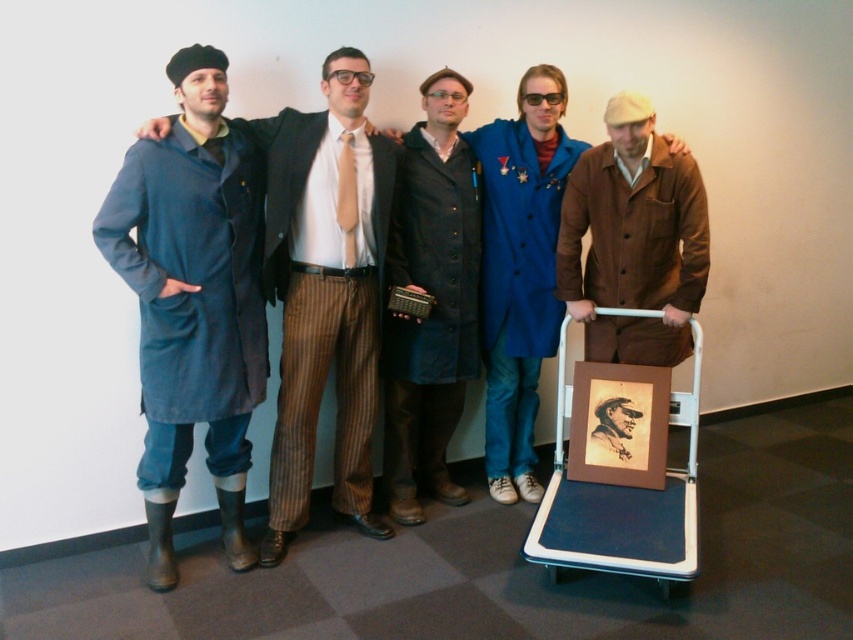
Question: Does denim coat at left come behind blue fabric cart at lower right?

Choices:
 (A) yes
 (B) no

Answer: (A)

Question: Observing the image, what is the correct spatial positioning of denim coat at left in reference to dark blue coat at center?

Choices:
 (A) below
 (B) above

Answer: (A)

Question: Estimate the real-world distances between objects in this image. Which object is closer to the brown suede jacket at right?

Choices:
 (A) blue wool coat at center
 (B) blue fabric cart at lower right
 (C) denim coat at left

Answer: (A)

Question: Which of the following is the farthest from the observer?

Choices:
 (A) blue wool coat at center
 (B) blue fabric cart at lower right

Answer: (A)

Question: Does dark blue coat at center have a lesser width compared to brown suede jacket at right?

Choices:
 (A) yes
 (B) no

Answer: (A)

Question: Which of the following is the closest to the observer?

Choices:
 (A) brown suede jacket at right
 (B) denim coat at left
 (C) blue wool coat at center
 (D) dark blue coat at center

Answer: (A)